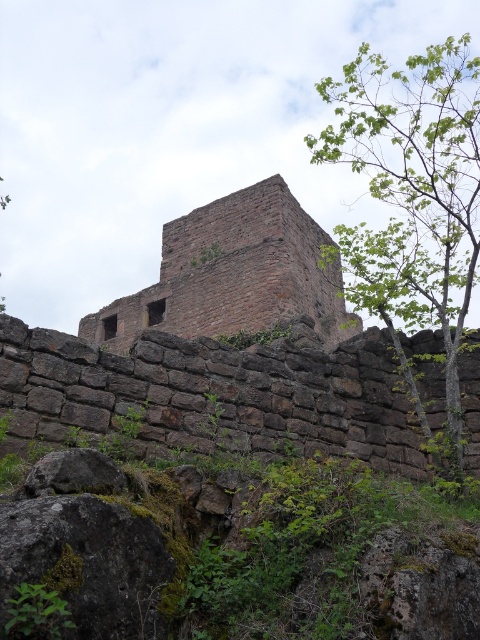
Question: Is brown stone wall at center positioned before green leafy tree at upper right?

Choices:
 (A) no
 (B) yes

Answer: (B)

Question: Is green leafy tree at upper right to the right of brown stone tower at center from the viewer's perspective?

Choices:
 (A) no
 (B) yes

Answer: (B)

Question: Which point appears closest to the camera in this image?

Choices:
 (A) (134, 365)
 (B) (363, 124)

Answer: (A)

Question: Is brown stone wall at center bigger than green leafy tree at upper right?

Choices:
 (A) yes
 (B) no

Answer: (B)

Question: Estimate the real-world distances between objects in this image. Which object is closer to the brown stone tower at center?

Choices:
 (A) green leafy tree at upper right
 (B) brown stone wall at center

Answer: (A)

Question: Which of these objects is positioned closest to the brown stone wall at center?

Choices:
 (A) green leafy tree at upper right
 (B) brown stone tower at center

Answer: (A)